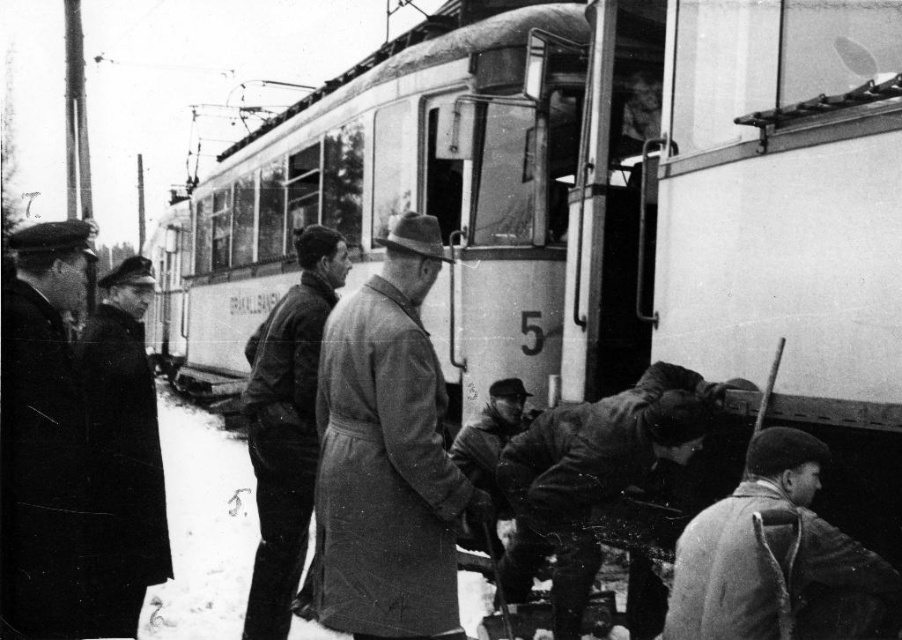
Is dark gray coat at left below dark brown leather jacket at center?

No, dark gray coat at left is not below dark brown leather jacket at center.

Between point (89, 452) and point (502, 417), which one is positioned in front?

Point (89, 452) is in front.

Does point (23, 336) come closer to viewer compared to point (476, 465)?

Yes, point (23, 336) is in front of point (476, 465).

At what (x,y) coordinates should I click in order to perform the action: click on dark gray coat at left. Please return your answer as a coordinate pair (x, y). Image resolution: width=902 pixels, height=640 pixels. Looking at the image, I should click on (52, 454).

Is dark gray coat at left positioned at the back of dark wool coat at center?

No, dark gray coat at left is closer to the viewer.

Does point (52, 380) come in front of point (318, 456)?

Yes.

Find the location of `dark gray coat at left`. dark gray coat at left is located at coordinates (52, 454).

Who is more distant from viewer, (811, 624) or (576, 531)?

Positioned behind is point (576, 531).

Does point (729, 524) lie behind point (559, 563)?

No.

This screenshot has width=902, height=640. Identify the location of dark brown leather jacket at lower right. (778, 557).